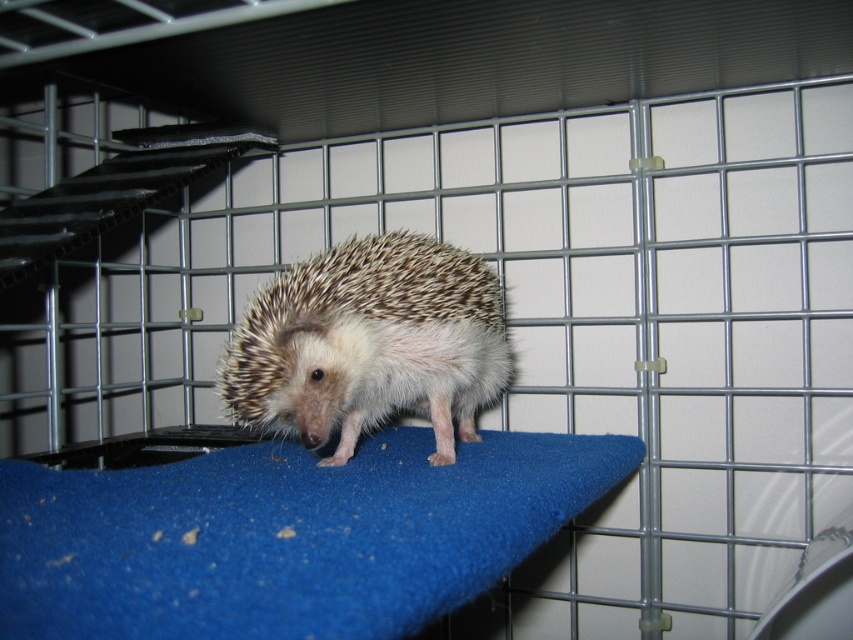
Question: Is blue felt mat at center positioned in front of brown spiny hedgehog at center?

Choices:
 (A) yes
 (B) no

Answer: (A)

Question: Which point appears closest to the camera in this image?

Choices:
 (A) (393, 300)
 (B) (379, 486)

Answer: (B)

Question: Can you confirm if blue felt mat at center is positioned to the right of brown spiny hedgehog at center?

Choices:
 (A) no
 (B) yes

Answer: (A)

Question: Can you confirm if blue felt mat at center is smaller than brown spiny hedgehog at center?

Choices:
 (A) no
 (B) yes

Answer: (B)